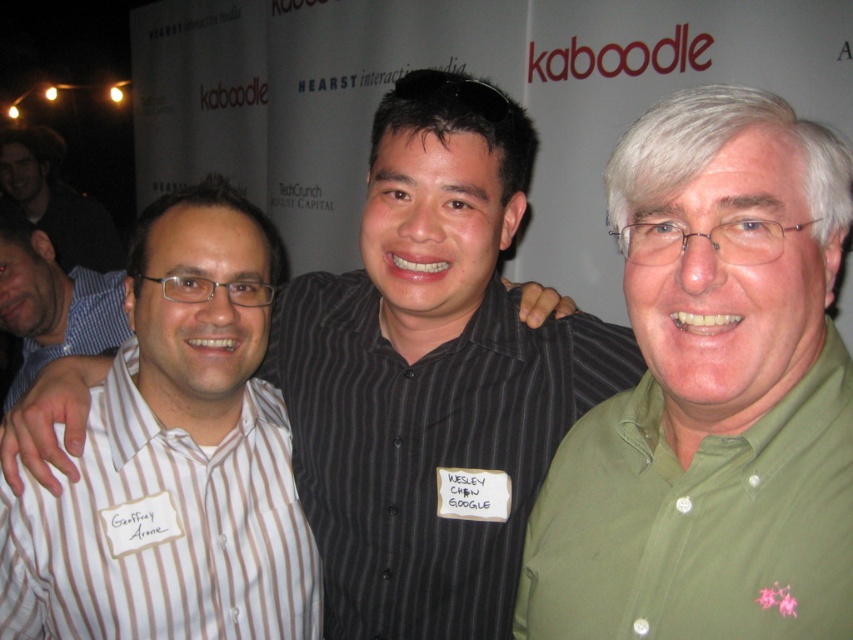
Question: Which point is farther to the camera?

Choices:
 (A) (410, 342)
 (B) (109, 512)

Answer: (A)

Question: Does striped shirt at center come in front of blue striped shirt at left?

Choices:
 (A) yes
 (B) no

Answer: (A)

Question: Which of the following is the closest to the observer?

Choices:
 (A) white striped shirt at center
 (B) striped shirt at center
 (C) dark brown hair at left

Answer: (B)

Question: Which object is positioned closest to the blue striped shirt at left?

Choices:
 (A) green cotton shirt at center
 (B) white striped shirt at center
 (C) dark brown hair at left
 (D) striped shirt at center

Answer: (B)

Question: Is striped shirt at center below blue striped shirt at left?

Choices:
 (A) no
 (B) yes

Answer: (B)

Question: Is the position of dark brown hair at left less distant than that of blue striped shirt at left?

Choices:
 (A) no
 (B) yes

Answer: (A)